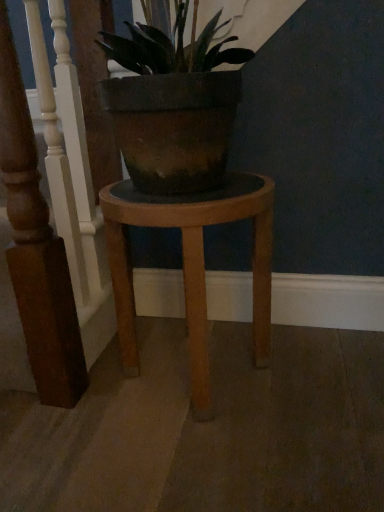
Locate an element on the screen. The width and height of the screenshot is (384, 512). free space that is in between wooden stool at center and white painted wood railing at left is located at coordinates (120, 354).